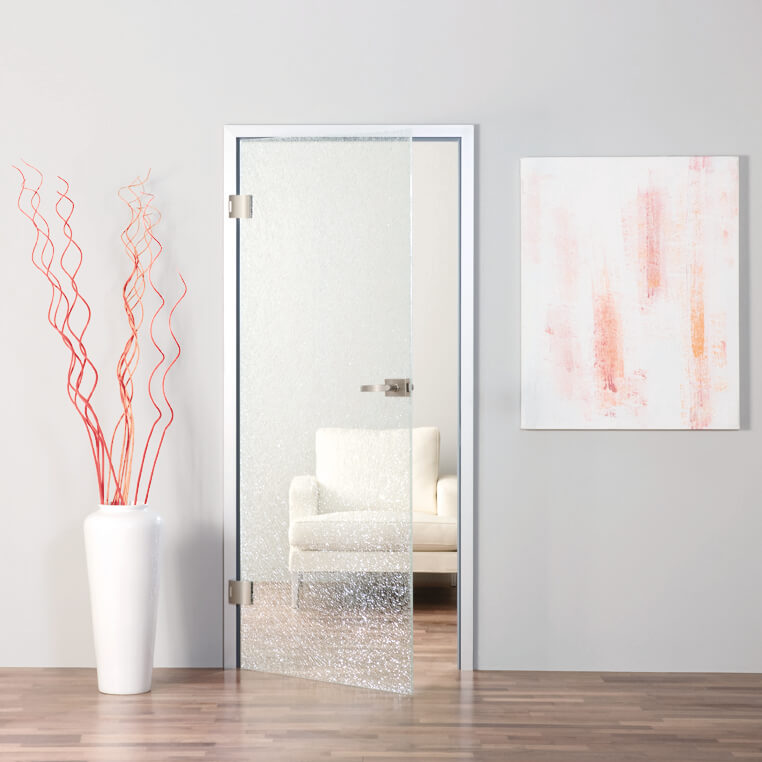
Where is `wall`? The width and height of the screenshot is (762, 762). wall is located at coordinates (670, 535), (101, 167).